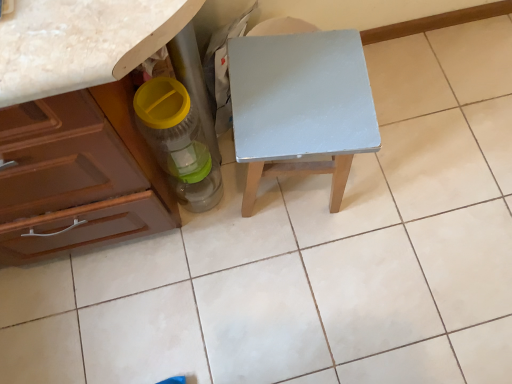
What do you see at coordinates (300, 107) in the screenshot? The image size is (512, 384). I see `light gray wood table at center` at bounding box center [300, 107].

I want to click on light gray wood table at center, so click(x=300, y=107).

Measure the distance between point (x=314, y=97) and camera.

91.10 centimeters.

What is the approximate height of light gray wood table at center?

The height of light gray wood table at center is 18.12 inches.

Describe the element at coordinates (178, 142) in the screenshot. The image size is (512, 384). I see `translucent plastic bottle at lower left` at that location.

Locate an element on the screen. translucent plastic bottle at lower left is located at coordinates (178, 142).

Where is `light gray wood table at center`? The image size is (512, 384). light gray wood table at center is located at coordinates (300, 107).

Visually, is light gray wood table at center positioned to the left or to the right of translucent plastic bottle at lower left?

In the image, light gray wood table at center appears on the right side of translucent plastic bottle at lower left.

Is the position of light gray wood table at center more distant than that of translucent plastic bottle at lower left?

Yes, it is behind translucent plastic bottle at lower left.

Does point (360, 124) come closer to viewer compared to point (192, 122)?

Yes, it is in front of point (192, 122).

From the image's perspective, is light gray wood table at center on top of translucent plastic bottle at lower left?

Yes, from the image's perspective, light gray wood table at center is on top of translucent plastic bottle at lower left.

From a real-world perspective, between light gray wood table at center and translucent plastic bottle at lower left, who is vertically higher?

In real-world perspective, translucent plastic bottle at lower left is above.

Is light gray wood table at center wider or thinner than translucent plastic bottle at lower left?

light gray wood table at center is wider than translucent plastic bottle at lower left.

Is light gray wood table at center taller or shorter than translucent plastic bottle at lower left?

Clearly, light gray wood table at center is taller compared to translucent plastic bottle at lower left.

In terms of size, does light gray wood table at center appear bigger or smaller than translucent plastic bottle at lower left?

Clearly, light gray wood table at center is larger in size than translucent plastic bottle at lower left.

Looking at this image, does light gray wood table at center contain translucent plastic bottle at lower left?

Actually, translucent plastic bottle at lower left is outside light gray wood table at center.

Is light gray wood table at center far from translucent plastic bottle at lower left?

No, light gray wood table at center is in close proximity to translucent plastic bottle at lower left.

Based on the photo, is translucent plastic bottle at lower left at the back of light gray wood table at center?

light gray wood table at center does not have its back to translucent plastic bottle at lower left.

This screenshot has width=512, height=384. I want to click on bottle on the left of light gray wood table at center, so pos(178,142).

In the scene shown: Between translucent plastic bottle at lower left and light gray wood table at center, which one appears on the left side from the viewer's perspective?

From the viewer's perspective, translucent plastic bottle at lower left appears more on the left side.

Considering the positions of objects translucent plastic bottle at lower left and light gray wood table at center in the image provided, who is in front, translucent plastic bottle at lower left or light gray wood table at center?

translucent plastic bottle at lower left is closer to the camera.

Is point (164, 88) closer to camera compared to point (252, 171)?

Yes.

From the image's perspective, is translucent plastic bottle at lower left positioned above or below light gray wood table at center?

translucent plastic bottle at lower left is situated lower than light gray wood table at center in the image.

Consider the image. From a real-world perspective, who is located higher, translucent plastic bottle at lower left or light gray wood table at center?

translucent plastic bottle at lower left.

Between translucent plastic bottle at lower left and light gray wood table at center, which one has smaller width?

With smaller width is translucent plastic bottle at lower left.

Does translucent plastic bottle at lower left have a greater height compared to light gray wood table at center?

In fact, translucent plastic bottle at lower left may be shorter than light gray wood table at center.

Can you confirm if translucent plastic bottle at lower left is smaller than light gray wood table at center?

Indeed, translucent plastic bottle at lower left has a smaller size compared to light gray wood table at center.

In the scene shown: Is translucent plastic bottle at lower left not inside light gray wood table at center?

That's correct, translucent plastic bottle at lower left is outside of light gray wood table at center.

Is translucent plastic bottle at lower left next to light gray wood table at center?

No, translucent plastic bottle at lower left is not in contact with light gray wood table at center.

Looking at this image, is translucent plastic bottle at lower left aimed at light gray wood table at center?

No, translucent plastic bottle at lower left is not facing towards light gray wood table at center.

You are a GUI agent. You are given a task and a screenshot of the screen. Output one action in this format:
    pyautogui.click(x=<x>, y=<y>)
    Task: Click on the bottle located in front of the light gray wood table at center
    Image resolution: width=512 pixels, height=384 pixels.
    Given the screenshot: What is the action you would take?
    pyautogui.click(x=178, y=142)

The image size is (512, 384). What are the coordinates of `bottle in front of the light gray wood table at center` in the screenshot? It's located at (x=178, y=142).

Identify the location of bottle above the light gray wood table at center (from a real-world perspective). Image resolution: width=512 pixels, height=384 pixels. (178, 142).